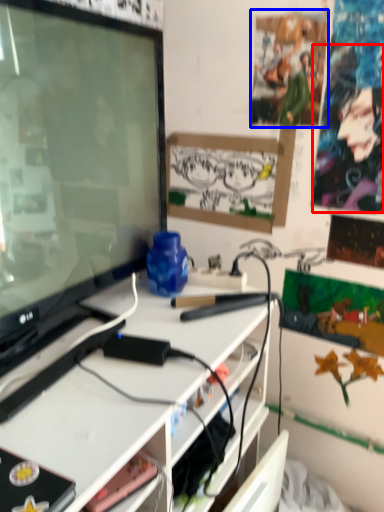
Question: Which object is further to the camera taking this photo, person (highlighted by a red box) or poster (highlighted by a blue box)?

Choices:
 (A) person
 (B) poster

Answer: (B)